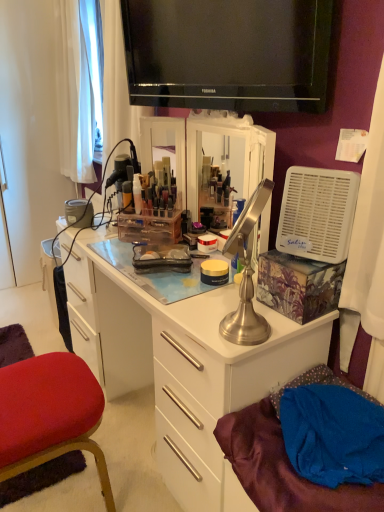
Question: Is satin silver lamp at center looking in the opposite direction of velvet red chair at lower left?

Choices:
 (A) no
 (B) yes

Answer: (A)

Question: From a real-world perspective, is satin silver lamp at center on velvet red chair at lower left?

Choices:
 (A) yes
 (B) no

Answer: (A)

Question: From the image's perspective, is satin silver lamp at center located above velvet red chair at lower left?

Choices:
 (A) no
 (B) yes

Answer: (B)

Question: Is the position of satin silver lamp at center more distant than that of velvet red chair at lower left?

Choices:
 (A) yes
 (B) no

Answer: (B)

Question: Does satin silver lamp at center have a lesser height compared to velvet red chair at lower left?

Choices:
 (A) no
 (B) yes

Answer: (A)

Question: Which is correct: black glossy television at upper center is inside blue fabric at lower right, or outside of it?

Choices:
 (A) inside
 (B) outside

Answer: (B)

Question: Looking at the image, does black glossy television at upper center seem bigger or smaller compared to blue fabric at lower right?

Choices:
 (A) small
 (B) big

Answer: (B)

Question: In terms of width, does black glossy television at upper center look wider or thinner when compared to blue fabric at lower right?

Choices:
 (A) thin
 (B) wide

Answer: (A)

Question: Considering the relative positions of black glossy television at upper center and blue fabric at lower right in the image provided, is black glossy television at upper center to the left or to the right of blue fabric at lower right?

Choices:
 (A) left
 (B) right

Answer: (A)

Question: Based on their sizes in the image, would you say black glossy television at upper center is bigger or smaller than velvet red chair at lower left?

Choices:
 (A) small
 (B) big

Answer: (B)

Question: From a real-world perspective, is black glossy television at upper center positioned above or below velvet red chair at lower left?

Choices:
 (A) above
 (B) below

Answer: (A)

Question: In terms of width, does black glossy television at upper center look wider or thinner when compared to velvet red chair at lower left?

Choices:
 (A) thin
 (B) wide

Answer: (A)

Question: From the image's perspective, is black glossy television at upper center above or below velvet red chair at lower left?

Choices:
 (A) above
 (B) below

Answer: (A)

Question: Is satin silver desk at center in front of or behind blue fabric at lower right in the image?

Choices:
 (A) front
 (B) behind

Answer: (B)

Question: Considering the positions of satin silver desk at center and blue fabric at lower right in the image, is satin silver desk at center bigger or smaller than blue fabric at lower right?

Choices:
 (A) small
 (B) big

Answer: (B)